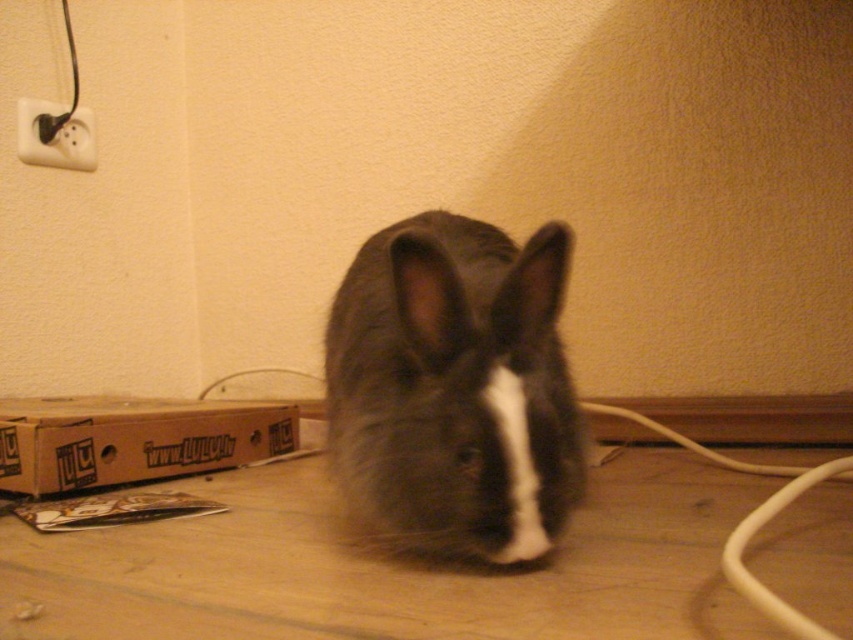
Consider the image. Between fuzzy gray rabbit at center and white plastic electric outlet at upper left, which one appears on the right side from the viewer's perspective?

fuzzy gray rabbit at center

Is fuzzy gray rabbit at center shorter than white plastic electric outlet at upper left?

Incorrect, fuzzy gray rabbit at center's height does not fall short of white plastic electric outlet at upper left's.

The height and width of the screenshot is (640, 853). In order to click on fuzzy gray rabbit at center in this screenshot , I will do `click(454, 387)`.

Locate an element on the screen. The image size is (853, 640). fuzzy gray rabbit at center is located at coordinates (454, 387).

Image resolution: width=853 pixels, height=640 pixels. What do you see at coordinates (132, 440) in the screenshot?
I see `brown cardboard box at lower left` at bounding box center [132, 440].

Who is shorter, brown cardboard box at lower left or white plastic electric outlet at upper left?

With less height is brown cardboard box at lower left.

Identify the location of brown cardboard box at lower left. (132, 440).

Does fuzzy gray rabbit at center lie in front of brown cardboard box at lower left?

That is True.

Which is behind, point (554, 380) or point (241, 451)?

The point (241, 451) is more distant.

Who is more forward, (440, 291) or (119, 426)?

Positioned in front is point (440, 291).

Locate an element on the screen. This screenshot has width=853, height=640. fuzzy gray rabbit at center is located at coordinates tap(454, 387).